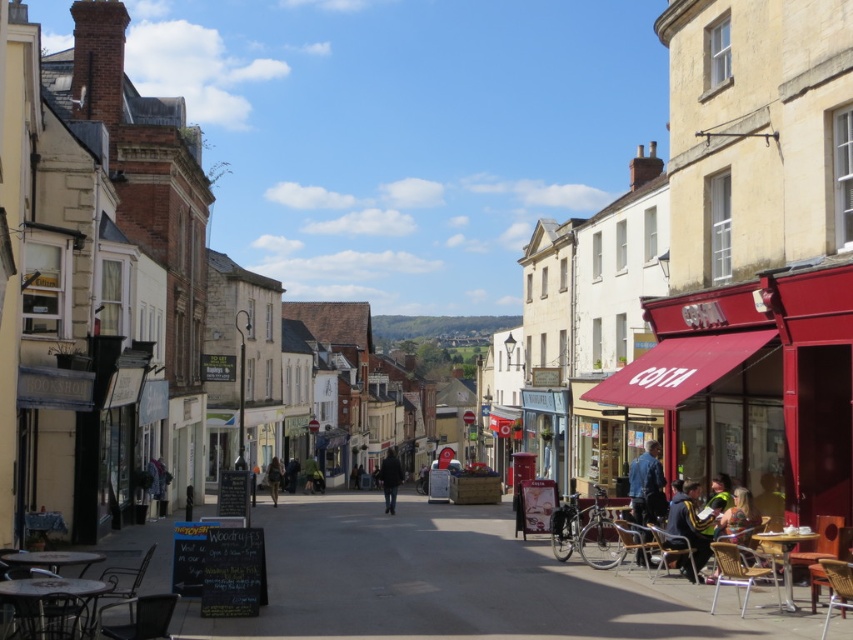
Question: Can you confirm if blue denim jacket at lower right is positioned below dark brown leather jacket at center?

Choices:
 (A) yes
 (B) no

Answer: (B)

Question: Which object is the farthest from the dark brown leather jacket at center?

Choices:
 (A) blue denim jacket at lower right
 (B) green fabric coat at center
 (C) dark blue jacket at center

Answer: (A)

Question: Which point is closer to the camera?

Choices:
 (A) blue denim jacket at lower right
 (B) dark brown leather jacket at center

Answer: (A)

Question: Can you confirm if dark brown leather jacket at center is positioned to the right of dark blue jacket at center?

Choices:
 (A) no
 (B) yes

Answer: (B)

Question: Considering the real-world distances, which object is farthest from the blue denim jacket at lower right?

Choices:
 (A) dark blue jacket at center
 (B) dark blue jacket at lower right

Answer: (A)

Question: Is blue denim jacket at lower right positioned behind black matte coat at center?

Choices:
 (A) no
 (B) yes

Answer: (A)